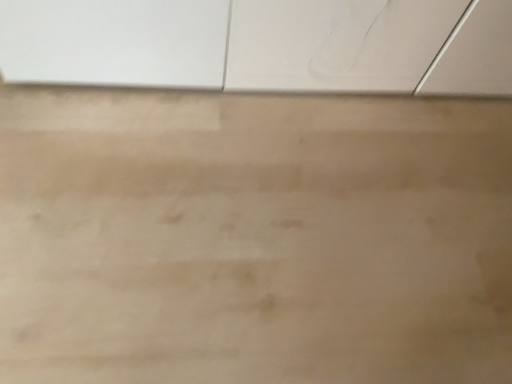
Measure the distance between point (500, 58) and camera.

1.24 meters.

Describe the element at coordinates (263, 45) in the screenshot. I see `white matte cabinet at upper center` at that location.

Where is `white matte cabinet at upper center`? This screenshot has height=384, width=512. white matte cabinet at upper center is located at coordinates (263, 45).

Locate an element on the screen. This screenshot has height=384, width=512. white matte cabinet at upper center is located at coordinates click(263, 45).